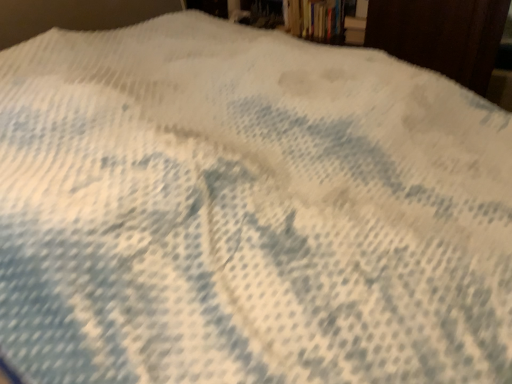
Question: Does hardcover book at upper center have a lesser height compared to hardcover book at upper right?

Choices:
 (A) yes
 (B) no

Answer: (B)

Question: Is hardcover book at upper center outside hardcover book at upper right?

Choices:
 (A) yes
 (B) no

Answer: (A)

Question: Considering the relative positions of hardcover book at upper center and hardcover book at upper right in the image provided, is hardcover book at upper center to the right of hardcover book at upper right from the viewer's perspective?

Choices:
 (A) yes
 (B) no

Answer: (B)

Question: Does hardcover book at upper center turn towards hardcover book at upper right?

Choices:
 (A) yes
 (B) no

Answer: (B)

Question: From a real-world perspective, is hardcover book at upper center below hardcover book at upper right?

Choices:
 (A) yes
 (B) no

Answer: (B)

Question: Is hardcover book at upper center further to camera compared to hardcover book at upper right?

Choices:
 (A) no
 (B) yes

Answer: (B)

Question: Considering the relative sizes of hardcover book at upper right and hardcover book at upper center in the image provided, is hardcover book at upper right shorter than hardcover book at upper center?

Choices:
 (A) yes
 (B) no

Answer: (A)

Question: Considering the relative sizes of hardcover book at upper right and hardcover book at upper center in the image provided, is hardcover book at upper right taller than hardcover book at upper center?

Choices:
 (A) yes
 (B) no

Answer: (B)

Question: Can you confirm if hardcover book at upper right is positioned to the left of hardcover book at upper center?

Choices:
 (A) yes
 (B) no

Answer: (B)

Question: Does hardcover book at upper right touch hardcover book at upper center?

Choices:
 (A) yes
 (B) no

Answer: (B)

Question: Can we say hardcover book at upper right lies outside hardcover book at upper center?

Choices:
 (A) yes
 (B) no

Answer: (A)

Question: From the image's perspective, is hardcover book at upper right below hardcover book at upper center?

Choices:
 (A) no
 (B) yes

Answer: (B)

Question: In terms of size, does hardcover book at upper right appear bigger or smaller than hardcover book at upper center?

Choices:
 (A) small
 (B) big

Answer: (A)